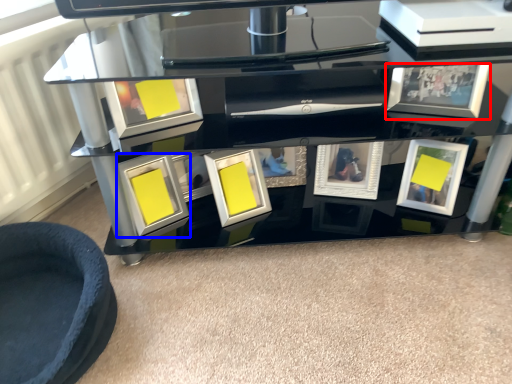
Question: Which of the following is the farthest to the observer, picture frame (highlighted by a red box) or picture frame (highlighted by a blue box)?

Choices:
 (A) picture frame
 (B) picture frame

Answer: (B)